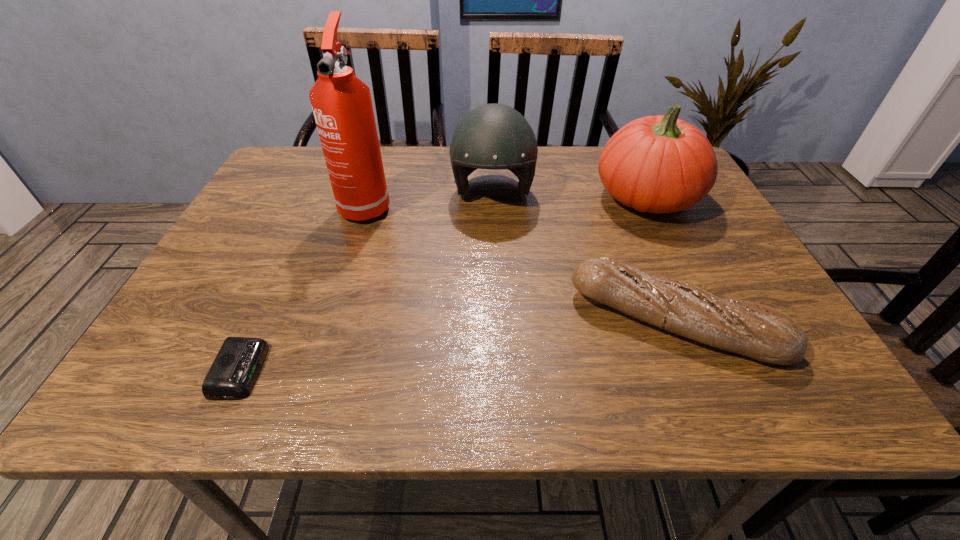
Locate an element on the screen. The height and width of the screenshot is (540, 960). object situated at the near left corner is located at coordinates (234, 371).

Where is `object that is positioned at the far right corner`? This screenshot has height=540, width=960. object that is positioned at the far right corner is located at coordinates (658, 164).

Identify the location of object that is at the near right corner. (760, 332).

Identify the location of vacant area at the far edge. This screenshot has width=960, height=540. (553, 153).

Image resolution: width=960 pixels, height=540 pixels. Find the location of `free space at the near edge of the desktop`. free space at the near edge of the desktop is located at coordinates (264, 400).

At what (x,y) coordinates should I click in order to perform the action: click on vacant space at the left edge. Please return your answer as a coordinate pair (x, y). The image size is (960, 540). Looking at the image, I should click on (295, 233).

Locate an element on the screen. This screenshot has height=540, width=960. free space at the right edge of the desktop is located at coordinates (670, 249).

This screenshot has height=540, width=960. I want to click on free region at the far left corner, so click(292, 173).

At what (x,y) coordinates should I click in order to perform the action: click on vacant region at the near left corner of the desktop. Please return your answer as a coordinate pair (x, y). Looking at the image, I should click on (144, 397).

Locate an element on the screen. This screenshot has height=540, width=960. vacant area between the pumpkin and the leftmost object is located at coordinates (444, 284).